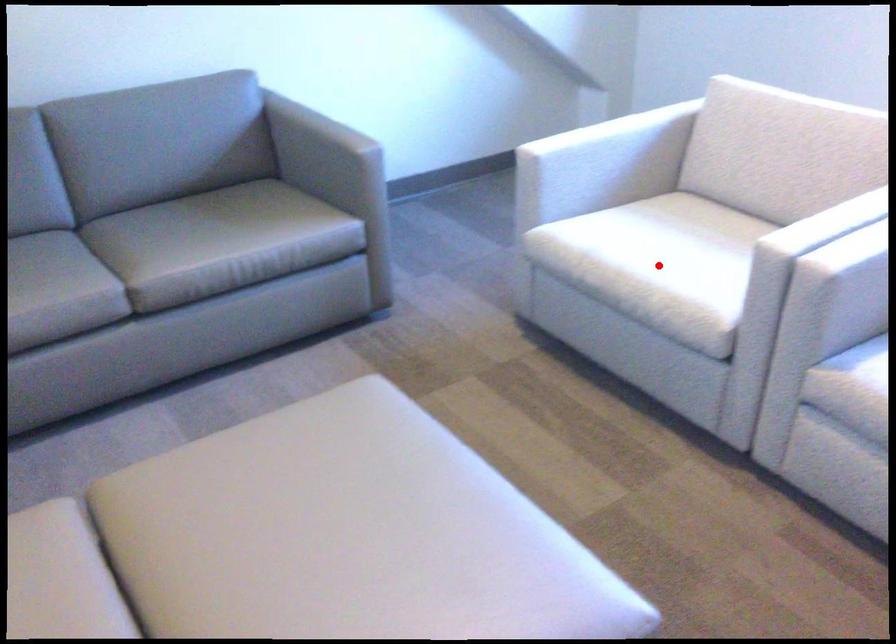
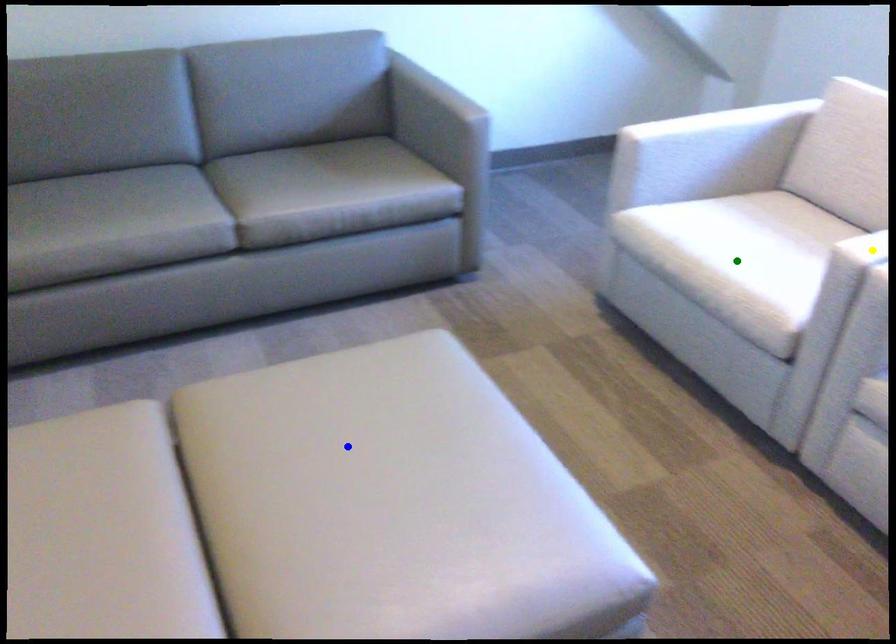
Question: I am providing you with two images of the same scene from different viewpoints. A red point is marked on the first image. You are given multiple points on the second image. Which point in image 2 is actually the same real-world point as the red point in image 1?

Choices:
 (A) yellow point
 (B) green point
 (C) blue point

Answer: (B)